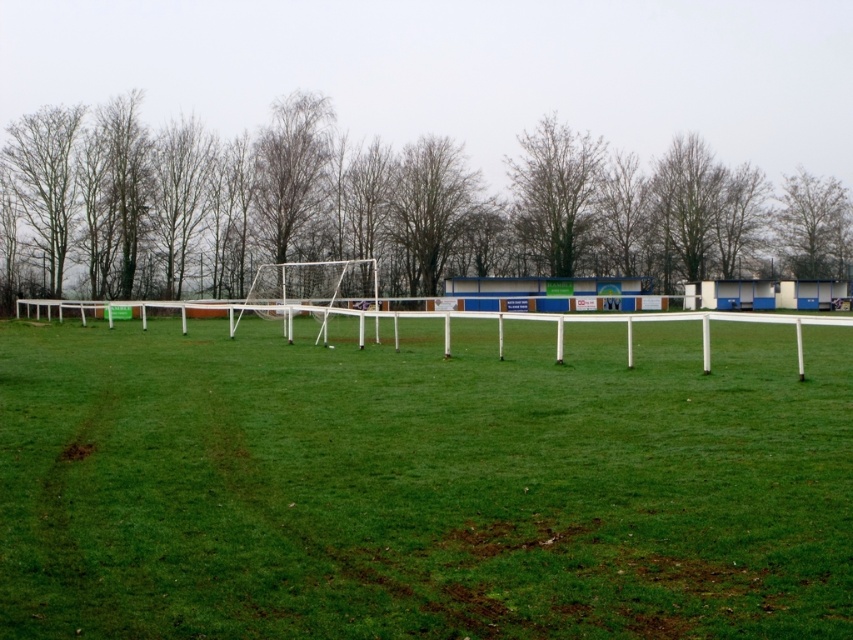
Looking at this image, is bare branches at center shorter than bare branches at upper right?

Incorrect, bare branches at center's height does not fall short of bare branches at upper right's.

Which of these two, bare branches at center or bare branches at upper right, stands shorter?

With less height is bare branches at upper right.

You are a GUI agent. You are given a task and a screenshot of the screen. Output one action in this format:
    pyautogui.click(x=<x>, y=<y>)
    Task: Click on the bare branches at center
    
    Given the screenshot: What is the action you would take?
    pyautogui.click(x=555, y=193)

Does green grass at center have a greater height compared to bare branches at center?

No.

Measure the distance from green grass at center to bare branches at center.

The distance of green grass at center from bare branches at center is 51.83 meters.

Is point (722, 358) more distant than point (573, 253)?

No, (722, 358) is closer to viewer.

Locate an element on the screen. green grass at center is located at coordinates (422, 483).

Between brown leafless tree at upper left and bare branches at upper right, which one has more height?

With more height is brown leafless tree at upper left.

Does point (642, 244) come behind point (817, 196)?

No, (642, 244) is closer to viewer.

I want to click on brown leafless tree at upper left, so click(383, 209).